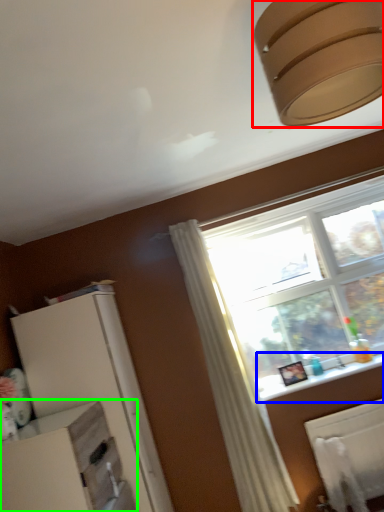
Question: Which object is positioned farthest from lamp (highlighted by a red box)? Select from window sill (highlighted by a blue box) and dresser (highlighted by a green box).

Choices:
 (A) window sill
 (B) dresser

Answer: (A)